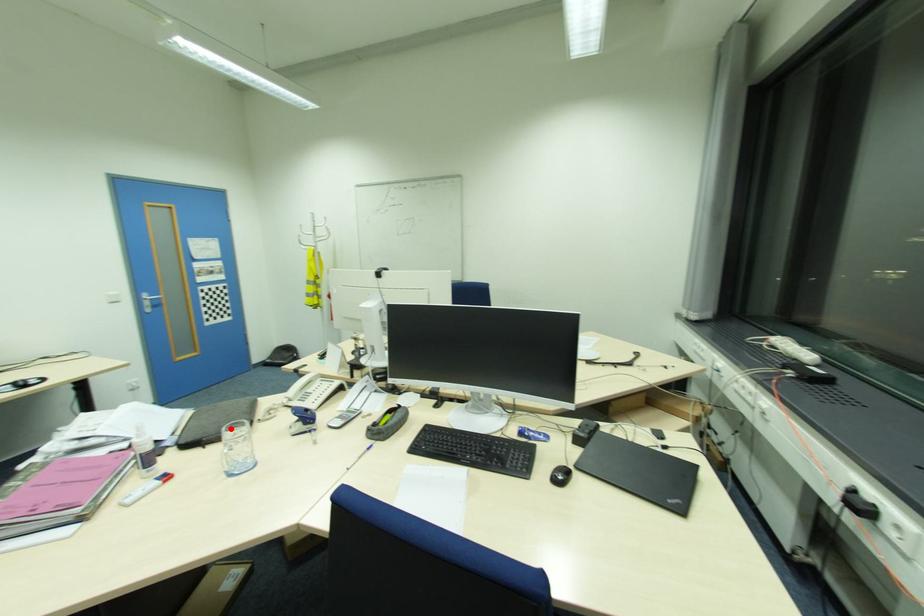
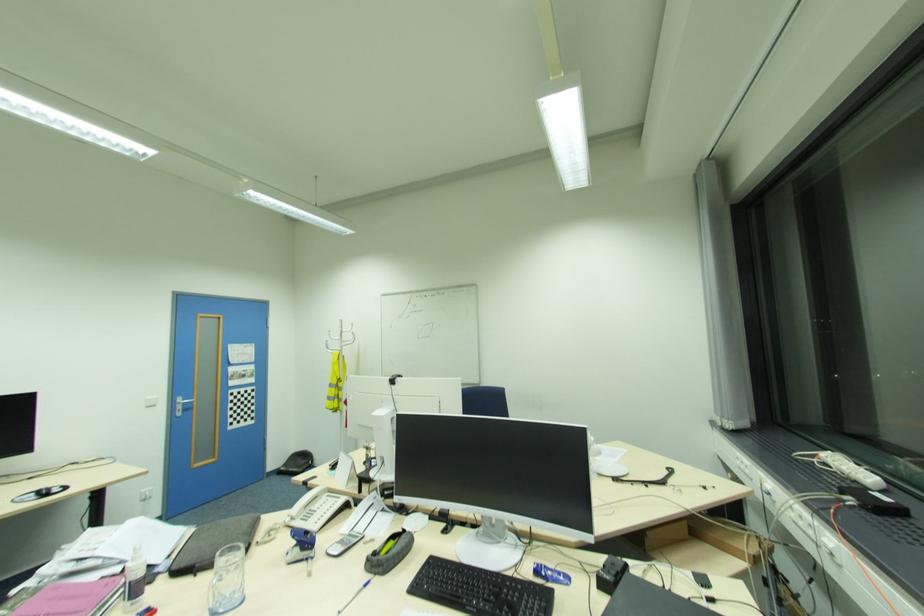
Find the pixel in the second image that matches the highlighted location in the first image.

(225, 554)